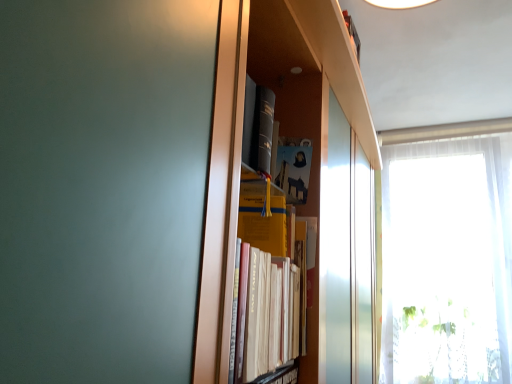
Question: Which direction should I rotate to look at yellow paper at center, which appears as the 1th paperback book when ordered from the bottom, — up or down?

Choices:
 (A) up
 (B) down

Answer: (B)

Question: Is yellow paper at center, acting as the 2th paperback book starting from the top, taller than yellow matte paper at center, the 1th paperback book positioned from the top?

Choices:
 (A) no
 (B) yes

Answer: (B)

Question: Is yellow paper at center, acting as the 2th paperback book starting from the top, to the right of yellow matte paper at center, the 2th paperback book from the bottom, from the viewer's perspective?

Choices:
 (A) yes
 (B) no

Answer: (B)

Question: Considering the relative sizes of yellow paper at center, acting as the 2th paperback book starting from the top, and yellow matte paper at center, the 2th paperback book from the bottom, in the image provided, is yellow paper at center, acting as the 2th paperback book starting from the top, thinner than yellow matte paper at center, the 2th paperback book from the bottom,?

Choices:
 (A) yes
 (B) no

Answer: (B)

Question: Does yellow paper at center, acting as the 2th paperback book starting from the top, appear on the left side of yellow matte paper at center, the 2th paperback book from the bottom?

Choices:
 (A) no
 (B) yes

Answer: (B)

Question: Does yellow paper at center, acting as the 2th paperback book starting from the top, turn towards yellow matte paper at center, the 1th paperback book positioned from the top?

Choices:
 (A) yes
 (B) no

Answer: (B)

Question: Can you confirm if yellow paper at center, which appears as the 1th paperback book when ordered from the bottom, is smaller than yellow matte paper at center, the 2th paperback book from the bottom?

Choices:
 (A) no
 (B) yes

Answer: (A)

Question: Is yellow paper at center, which appears as the 1th paperback book when ordered from the bottom, looking in the opposite direction of white sheer curtain at right?

Choices:
 (A) no
 (B) yes

Answer: (B)

Question: Is yellow paper at center, acting as the 2th paperback book starting from the top, positioned far away from white sheer curtain at right?

Choices:
 (A) no
 (B) yes

Answer: (B)

Question: Does yellow paper at center, which appears as the 1th paperback book when ordered from the bottom, have a greater width compared to white sheer curtain at right?

Choices:
 (A) yes
 (B) no

Answer: (B)

Question: From a real-world perspective, is yellow paper at center, which appears as the 1th paperback book when ordered from the bottom, beneath white sheer curtain at right?

Choices:
 (A) yes
 (B) no

Answer: (A)

Question: From the image's perspective, is yellow paper at center, acting as the 2th paperback book starting from the top, above white sheer curtain at right?

Choices:
 (A) no
 (B) yes

Answer: (B)

Question: Considering the relative sizes of yellow paper at center, acting as the 2th paperback book starting from the top, and white sheer curtain at right in the image provided, is yellow paper at center, acting as the 2th paperback book starting from the top, shorter than white sheer curtain at right?

Choices:
 (A) no
 (B) yes

Answer: (B)

Question: Does white sheer curtain at right lie in front of yellow matte paper at center, the 2th paperback book from the bottom?

Choices:
 (A) yes
 (B) no

Answer: (B)